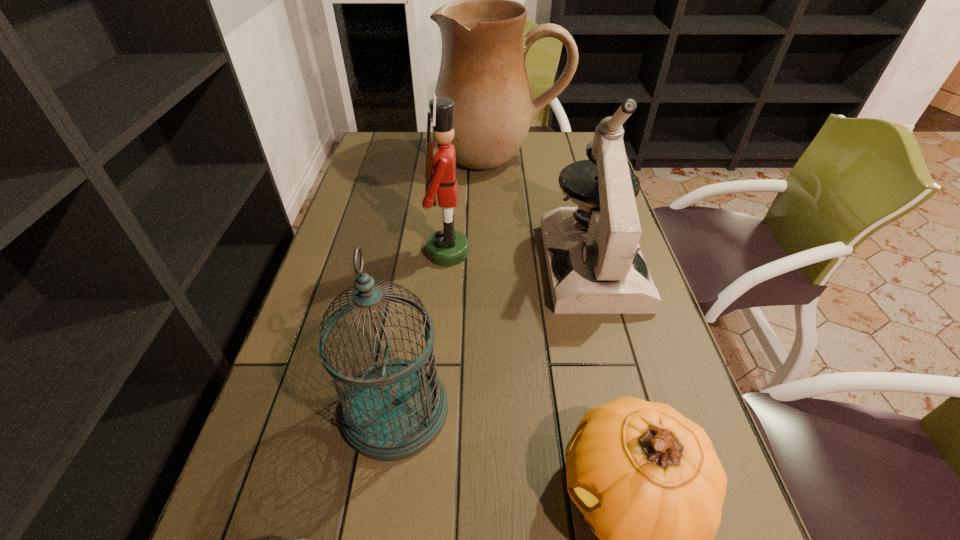
You are a GUI agent. You are given a task and a screenshot of the screen. Output one action in this format:
    pyautogui.click(x=<x>, y=<y>)
    Task: Click on the cream pitcher at the right edge
    This screenshot has height=540, width=960.
    Given the screenshot: What is the action you would take?
    pyautogui.click(x=482, y=70)

Locate an element on the screen. This screenshot has width=960, height=540. microscope present at the right edge is located at coordinates (602, 271).

This screenshot has height=540, width=960. In order to click on object that is at the far right corner in this screenshot , I will do `click(482, 70)`.

Find the location of `free location at the far edge of the desktop`. free location at the far edge of the desktop is located at coordinates (544, 151).

Image resolution: width=960 pixels, height=540 pixels. Find the location of `free space at the left edge`. free space at the left edge is located at coordinates (324, 281).

Find the location of `free spot at the right edge of the desktop`. free spot at the right edge of the desktop is located at coordinates (646, 334).

Find the location of `unoccupied area between the birdcage and the microscope`. unoccupied area between the birdcage and the microscope is located at coordinates (493, 336).

This screenshot has height=540, width=960. I want to click on free space between the nutcracker and the farthest object, so click(473, 205).

Where is `free spot between the microscope and the farthest object`? The image size is (960, 540). free spot between the microscope and the farthest object is located at coordinates (545, 211).

The width and height of the screenshot is (960, 540). Identify the location of the third closest object relative to the cream pitcher. (393, 410).